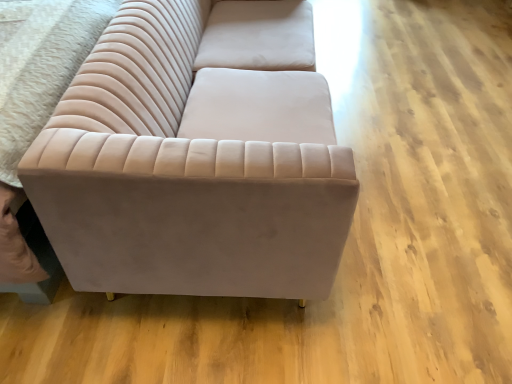
This screenshot has height=384, width=512. I want to click on unoccupied region to the right of matte pink fabric couch at center, so click(426, 135).